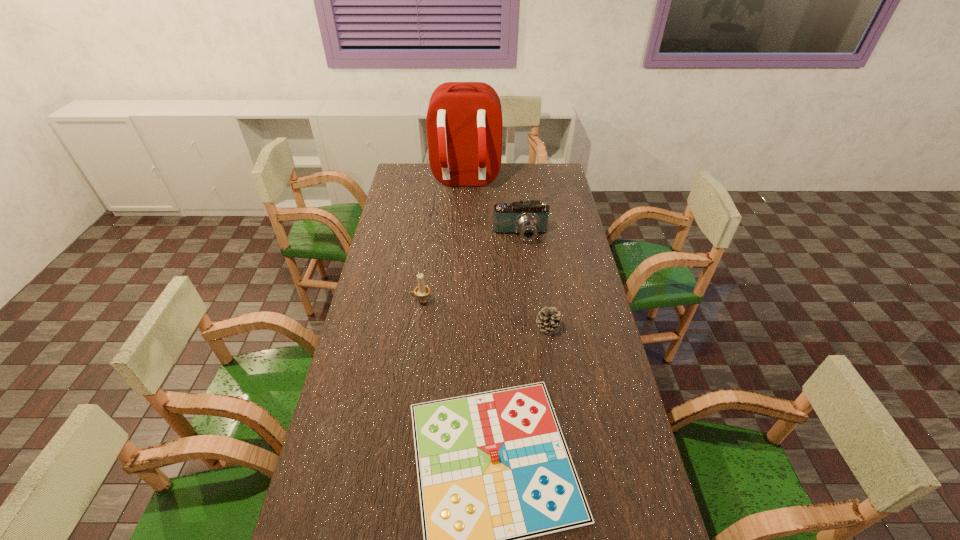
Where is `vacant area that lies between the candle_holder and the second farthest object`? Image resolution: width=960 pixels, height=540 pixels. vacant area that lies between the candle_holder and the second farthest object is located at coordinates [471, 268].

The width and height of the screenshot is (960, 540). I want to click on free spot between the pinecone and the tallest object, so click(x=506, y=254).

Where is `free point between the fourth nearest object and the candle_holder`? This screenshot has width=960, height=540. free point between the fourth nearest object and the candle_holder is located at coordinates (471, 268).

Identify the location of unoccupied position between the fourth tallest object and the fourth nearest object. This screenshot has width=960, height=540. (534, 281).

Image resolution: width=960 pixels, height=540 pixels. What are the coordinates of `vacant space that is in between the fourth nearest object and the second nearest object` in the screenshot? It's located at (534, 281).

The image size is (960, 540). I want to click on vacant area that lies between the fourth tallest object and the camcorder, so click(534, 281).

Select which object appears as the third closest to the gameboard. Please provide its 2D coordinates. Your answer should be formatted as a tuple, i.e. [(x, y)], where the tuple contains the x and y coordinates of a point satisfying the conditions above.

[(530, 218)]

Find the location of a particular element. object that is the second closest to the shortest object is located at coordinates (422, 290).

Where is `vacant position in the image that satisfies the following two spatial constraints: 1. on the handle side of the third farthest object; 2. on the left side of the pinecone`? The image size is (960, 540). vacant position in the image that satisfies the following two spatial constraints: 1. on the handle side of the third farthest object; 2. on the left side of the pinecone is located at coordinates (418, 327).

The width and height of the screenshot is (960, 540). In order to click on vacant region that satisfies the following two spatial constraints: 1. on the strap side of the second nearest object; 2. on the left side of the backpack in this screenshot , I will do `click(457, 327)`.